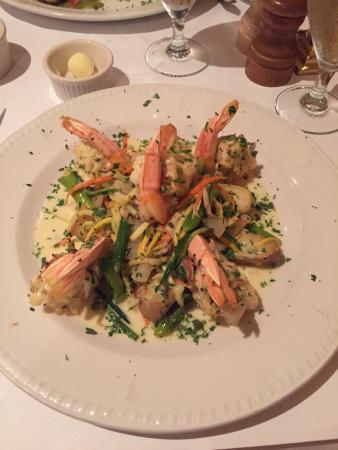
Locate an element on the screen. The width and height of the screenshot is (338, 450). pepper grinder is located at coordinates (272, 40).